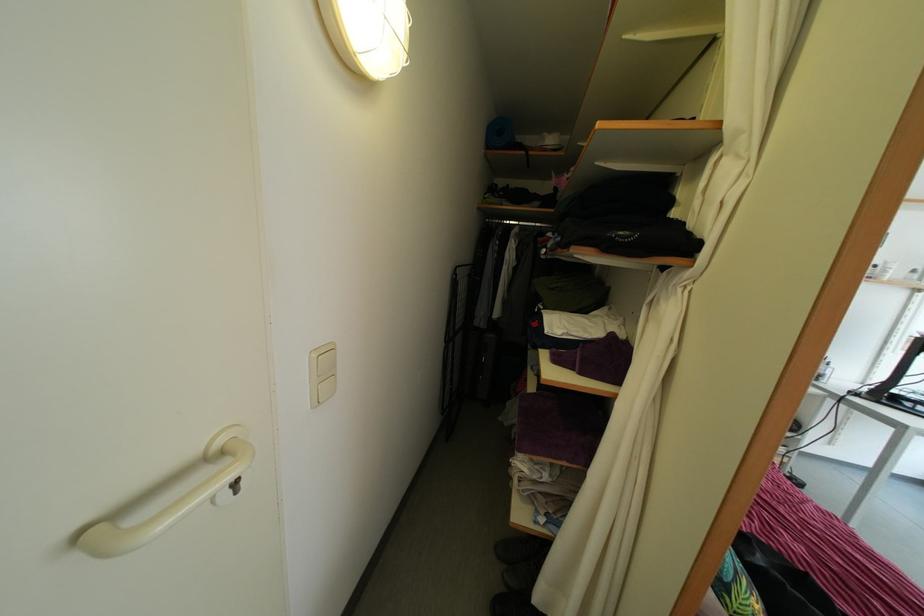
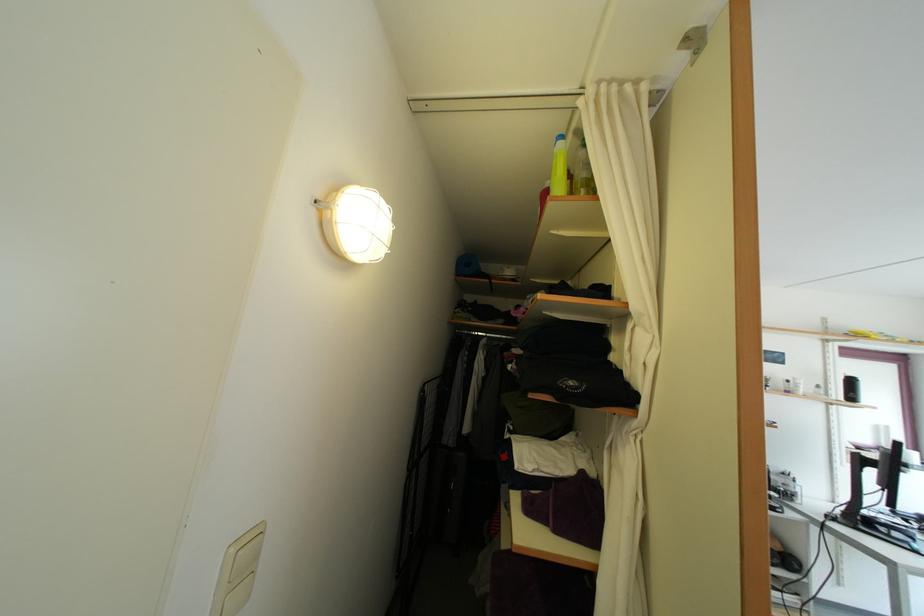
Question: What movement of the cameraman would produce the second image?

Choices:
 (A) Left
 (B) Right
 (C) Forward
 (D) Backward

Answer: (D)